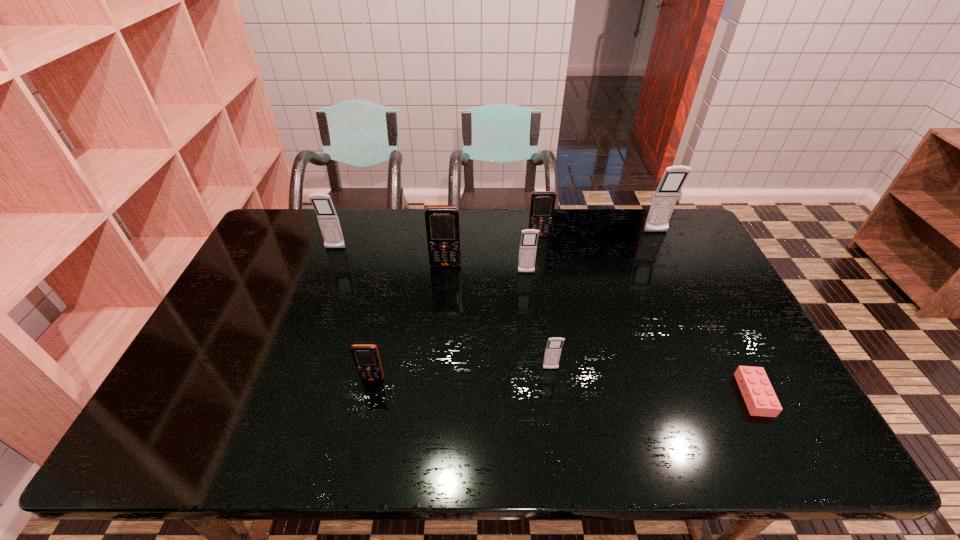
Where is `the leftmost orange cellular telephone`? Image resolution: width=960 pixels, height=540 pixels. the leftmost orange cellular telephone is located at coordinates [x=366, y=358].

What are the coordinates of `the sixth cellular telephone from right to left` in the screenshot? It's located at (366, 358).

This screenshot has width=960, height=540. Identify the location of the smallest gray cellular telephone. (553, 349).

The image size is (960, 540). Find the location of `the sixth farthest cellular telephone`. the sixth farthest cellular telephone is located at coordinates (553, 349).

Locate an element on the screen. the shortest object is located at coordinates (757, 391).

I want to click on Lego, so click(x=757, y=391).

Find the location of `free space located on the front-facing side of the rightmost cellular telephone`. free space located on the front-facing side of the rightmost cellular telephone is located at coordinates (681, 285).

I want to click on vacant area situated on the front-facing side of the leftmost cellular telephone, so click(x=326, y=271).

Locate an element on the screen. This screenshot has height=540, width=960. blank area located on the screen of the second orange cellular telephone from left to right is located at coordinates (437, 362).

At what (x,y) coordinates should I click in order to perform the action: click on vacant region located on the front-facing side of the third farthest gray cellular telephone. Please return your answer as a coordinate pair (x, y). This screenshot has height=540, width=960. Looking at the image, I should click on (531, 313).